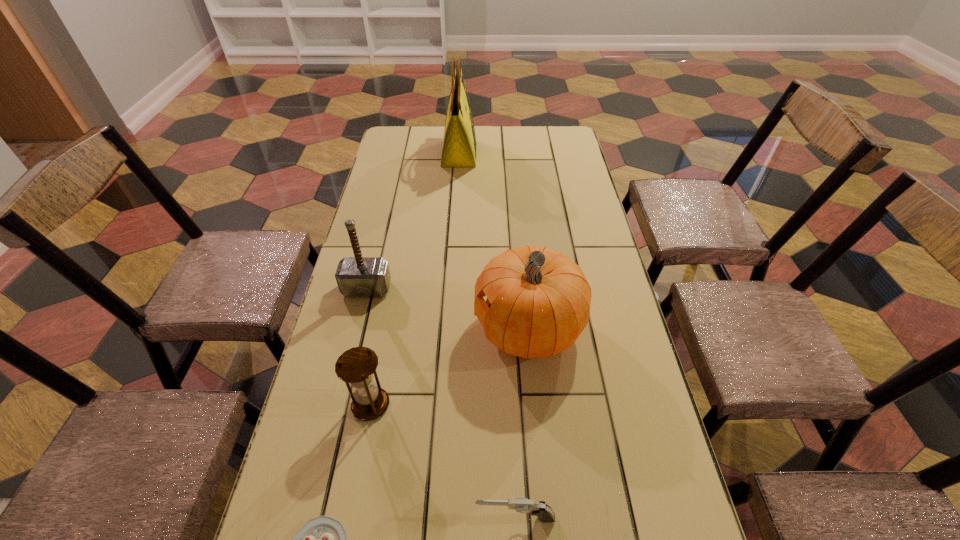
Where is `vacant space at the far edge`? The width and height of the screenshot is (960, 540). vacant space at the far edge is located at coordinates coord(436,151).

Where is `vacant area at the left edge`? The image size is (960, 540). vacant area at the left edge is located at coordinates (415, 158).

Where is `free space at the right edge of the desktop`? Image resolution: width=960 pixels, height=540 pixels. free space at the right edge of the desktop is located at coordinates (554, 160).

You are a GUI agent. You are given a task and a screenshot of the screen. Output one action in this format:
    pyautogui.click(x=<x>, y=<y>)
    Task: Click on the vacant region at the far left corner of the desktop
    
    Given the screenshot: What is the action you would take?
    pyautogui.click(x=419, y=138)

Image resolution: width=960 pixels, height=540 pixels. I want to click on vacant area at the far right corner of the desktop, so click(x=557, y=143).

This screenshot has width=960, height=540. Identify the location of empty space that is in between the hammer and the hourglass. (369, 347).

At what (x,y) coordinates should I click in order to perform the action: click on vacant space that is in between the pumpkin and the fifth tallest object. Please return your answer as a coordinate pair (x, y). Looking at the image, I should click on (522, 423).

The width and height of the screenshot is (960, 540). Find the location of `free space between the third nearest object and the pumpkin`. free space between the third nearest object and the pumpkin is located at coordinates (449, 367).

Image resolution: width=960 pixels, height=540 pixels. I want to click on free space that is in between the pumpkin and the gun, so click(522, 423).

The width and height of the screenshot is (960, 540). What are the coordinates of `vacant space that is in between the hammer and the farthest object` in the screenshot? It's located at (413, 221).